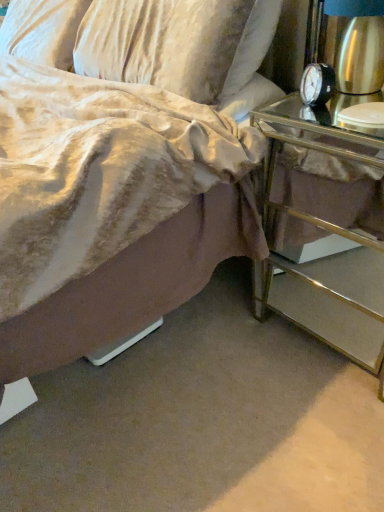
The height and width of the screenshot is (512, 384). In order to click on free space in front of metallic mirrored nightstand at right in this screenshot , I will do `click(316, 442)`.